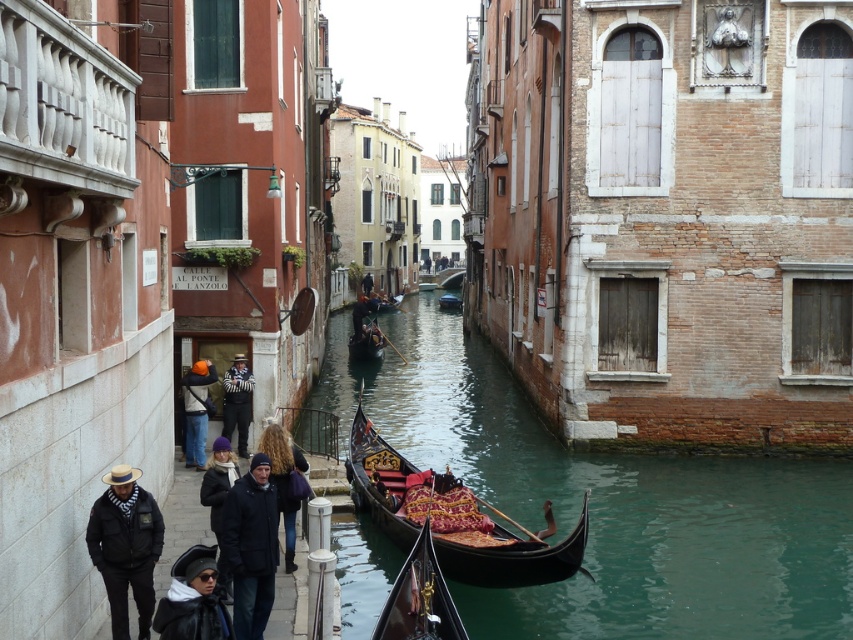
You are standing at the center of the canal and want to reach the black matte jacket at lower left. Which direction should you move to get there?

The black matte jacket at lower left is located at point (125, 547), which is to the lower left direction from your current position at the center of the canal.